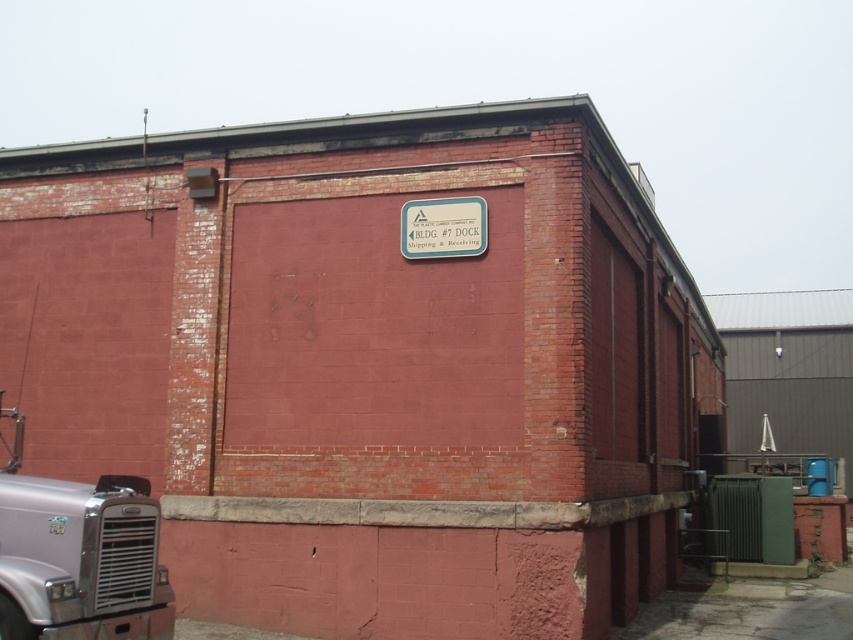
Question: Is the position of silver metallic truck at lower left more distant than that of metallic blue sign at center?

Choices:
 (A) yes
 (B) no

Answer: (B)

Question: Which of the following is the closest to the observer?

Choices:
 (A) (410, 230)
 (B) (57, 483)

Answer: (B)

Question: Is silver metallic truck at lower left below metallic blue sign at center?

Choices:
 (A) yes
 (B) no

Answer: (A)

Question: Is silver metallic truck at lower left smaller than metallic blue sign at center?

Choices:
 (A) no
 (B) yes

Answer: (A)